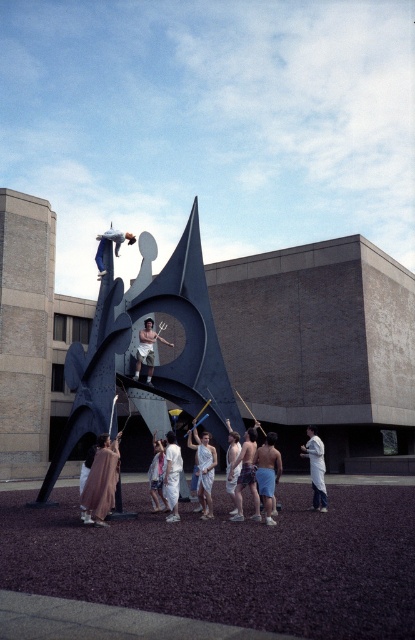
You are an observer standing in front of the sculpture. You see a white clothed figure at center and a smooth white statue at center. Which one is more to the left?

The white clothed figure at center is more to the left than the smooth white statue at center.

You are a photographer standing at the edge of the scene. You want to take a photo that includes both the white lab coat at center and the white clothed figure at center. Given that your camera has a maximum focus range of 10 meters, will you be able to capture both subjects in focus simultaneously?

The distance between the white lab coat at center and the white clothed figure at center is 11.15 meters, which exceeds the camera maximum focus range of 10 meters. Therefore, you cannot capture both subjects in focus simultaneously.

You are standing at the point with coordinates (x=129, y=340) in the image. What object are you standing on?

You are standing on the polished steel sculpture at center, which is represented by the point (x=129, y=340).